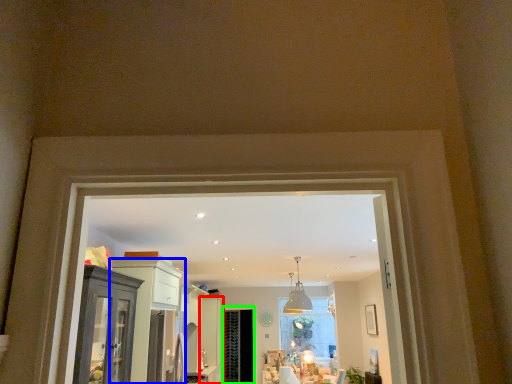
Question: Which is nearer to the door (highlighted by a red box)? cabinetry (highlighted by a blue box) or screen door (highlighted by a green box).

Choices:
 (A) cabinetry
 (B) screen door

Answer: (B)